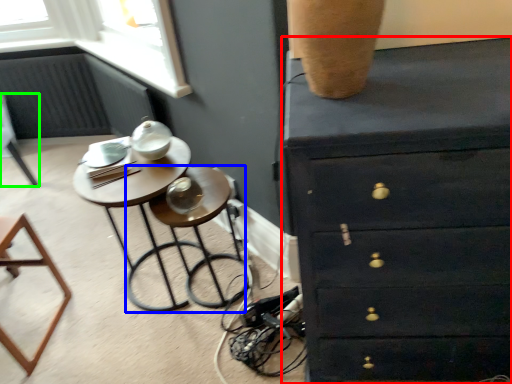
Question: Based on their relative distances, which object is nearer to chest of drawers (highlighted by a red box)? Choose from bar stool (highlighted by a blue box) and furniture (highlighted by a green box).

Choices:
 (A) bar stool
 (B) furniture

Answer: (A)